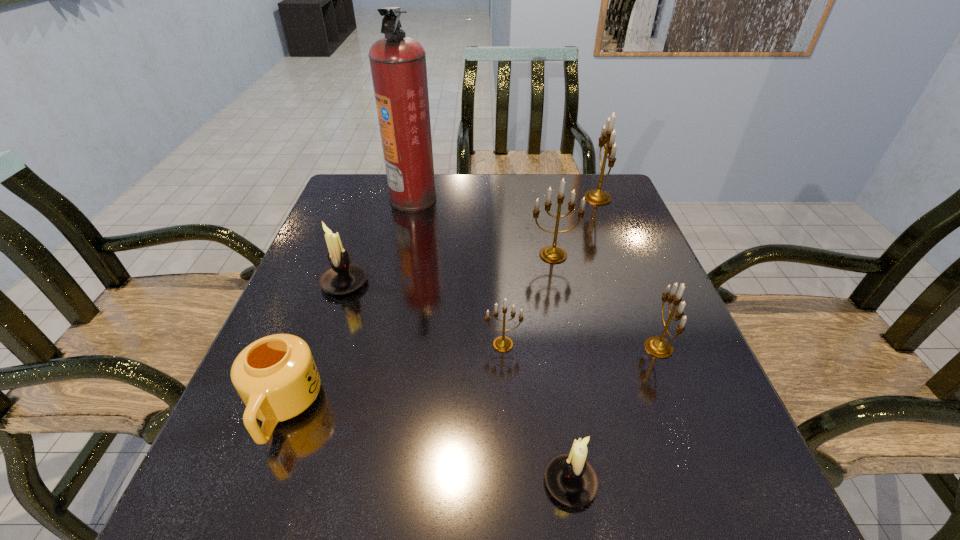
Image resolution: width=960 pixels, height=540 pixels. In order to click on free space at the far edge in this screenshot , I will do `click(451, 178)`.

The image size is (960, 540). I want to click on vacant space at the near edge of the desktop, so click(503, 482).

Where is `vacant space at the left edge of the desktop`? The height and width of the screenshot is (540, 960). vacant space at the left edge of the desktop is located at coordinates (354, 302).

I want to click on free space at the right edge of the desktop, so click(x=580, y=238).

Locate an element on the screen. The height and width of the screenshot is (540, 960). vacant area at the far right corner is located at coordinates (573, 210).

In the image, there is a desktop. Where is `free region at the near right corner`? free region at the near right corner is located at coordinates (675, 477).

Identify the location of free spot between the smallest gold candelabrum and the farthest gold candelabrum. (550, 271).

Locate an element on the screen. free space between the second farthest candelabrum and the leftmost gold candelabrum is located at coordinates (528, 300).

I want to click on free space between the third nearest gold candelabrum and the third farthest candelabrum, so tap(448, 269).

Locate an element on the screen. The image size is (960, 540). vacant space that's between the third tallest object and the smallest gold candelabrum is located at coordinates (528, 300).